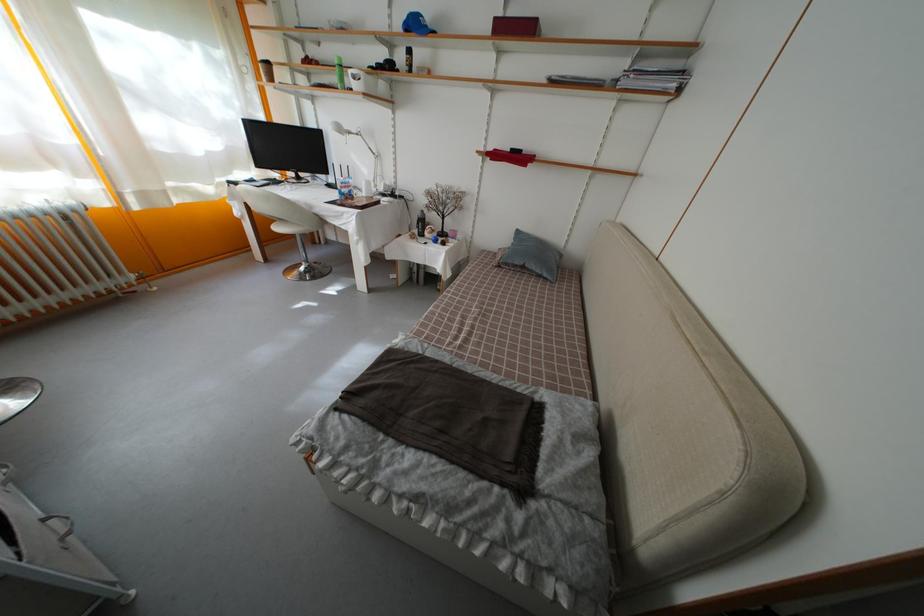
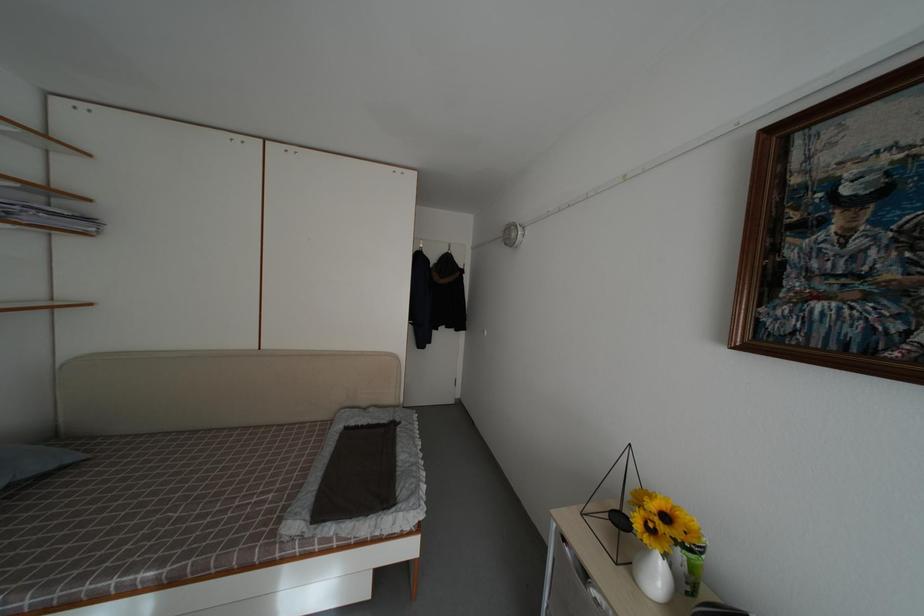
Locate, in the second image, the point that corresponds to (x=596, y=459) in the first image.

(378, 416)